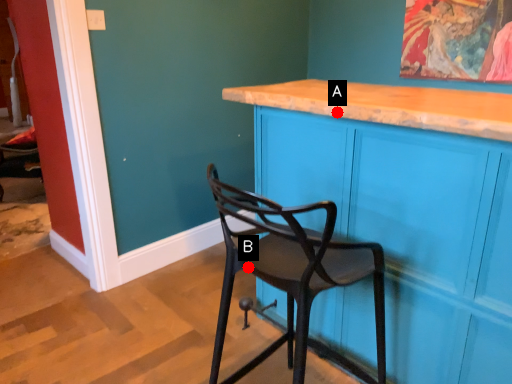
Question: Two points are circled on the image, labeled by A and B beside each circle. Which point is closer to the camera?

Choices:
 (A) A is closer
 (B) B is closer

Answer: (B)